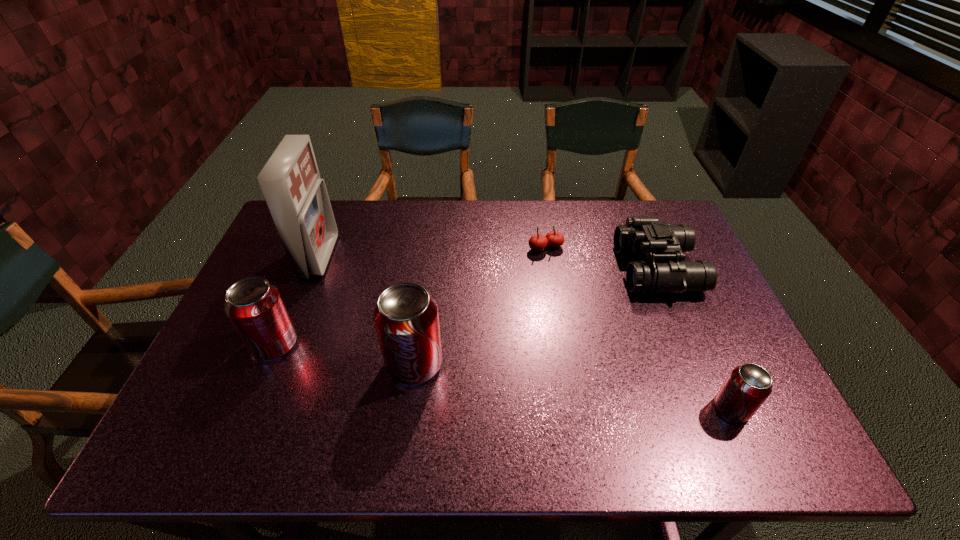
The height and width of the screenshot is (540, 960). I want to click on free space that satisfies the following two spatial constraints: 1. on the front-facing side of the tallest object; 2. on the left side of the fourth object from right to left, so click(277, 364).

Where is `free point that satisfies the following two spatial constraints: 1. on the back side of the fourth object from left to right; 2. on the left side of the second soda can from right to left`? The image size is (960, 540). free point that satisfies the following two spatial constraints: 1. on the back side of the fourth object from left to right; 2. on the left side of the second soda can from right to left is located at coordinates (429, 248).